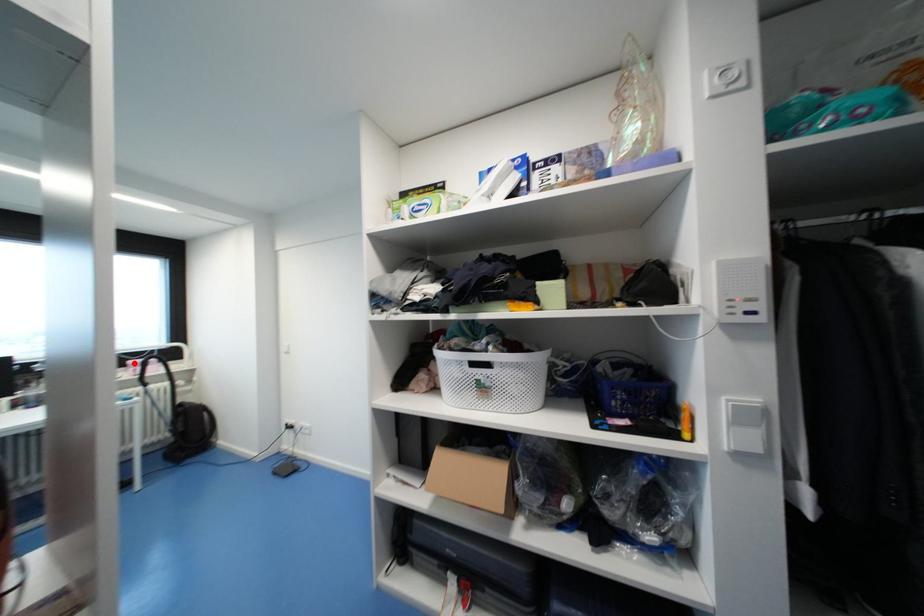
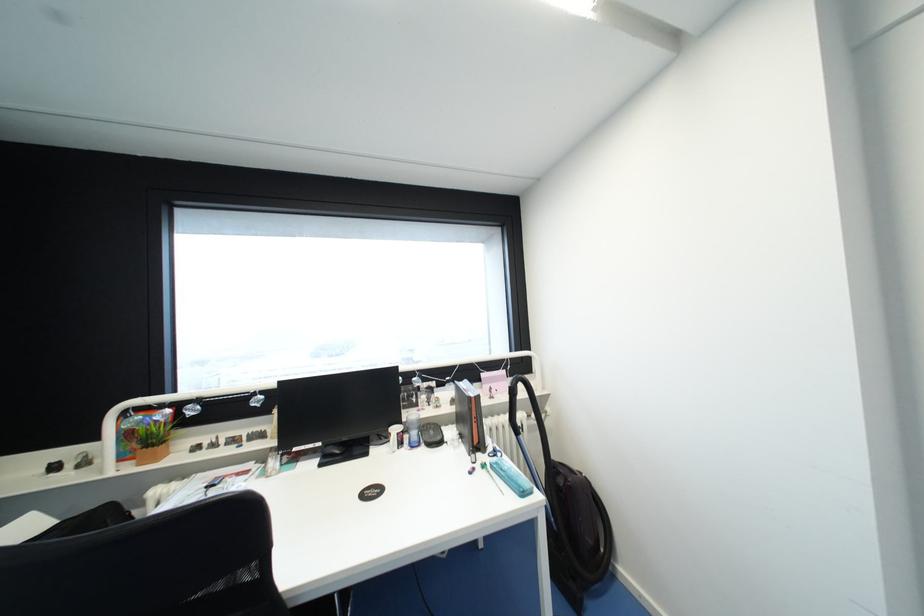
Question: I am providing you with two images of the same scene from different viewpoints. A red point is marked on the first image. Is the red point's position out of view in image 2?

Choices:
 (A) Yes
 (B) No

Answer: (B)